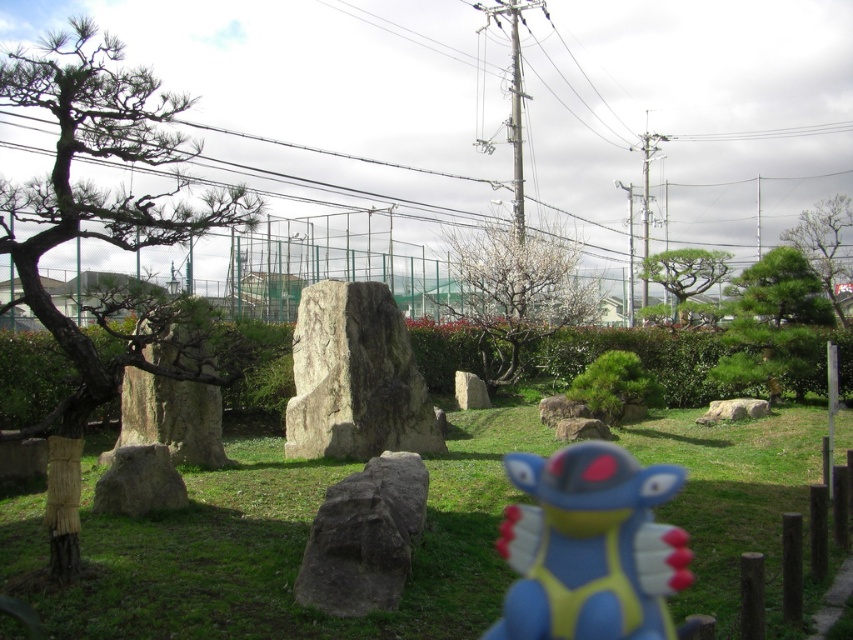
You are planning to place a new bench in the park. The bench you have is 2 meters long. You want to place it near the natural stone monument at center and the green matte tree at upper right. Which object should you place the bench next to so that it fits without exceeding its width?

The natural stone monument at center has a larger width than the green matte tree at upper right. Therefore, placing the 2m bench next to the natural stone monument at center would be more appropriate as it can accommodate the bench without exceeding its width.

You are a photographer setting up a shot in the park. You want to capture both the natural stone monument at center and the green matte tree at upper right in your frame. Which object should you position closer to the left side of your camera viewfinder to ensure both are included?

The natural stone monument at center should be positioned closer to the left side of the camera viewfinder because it is already on the left side of the green matte tree at upper right, so placing it on the left maintains their relative positions and ensures both fit in the frame.